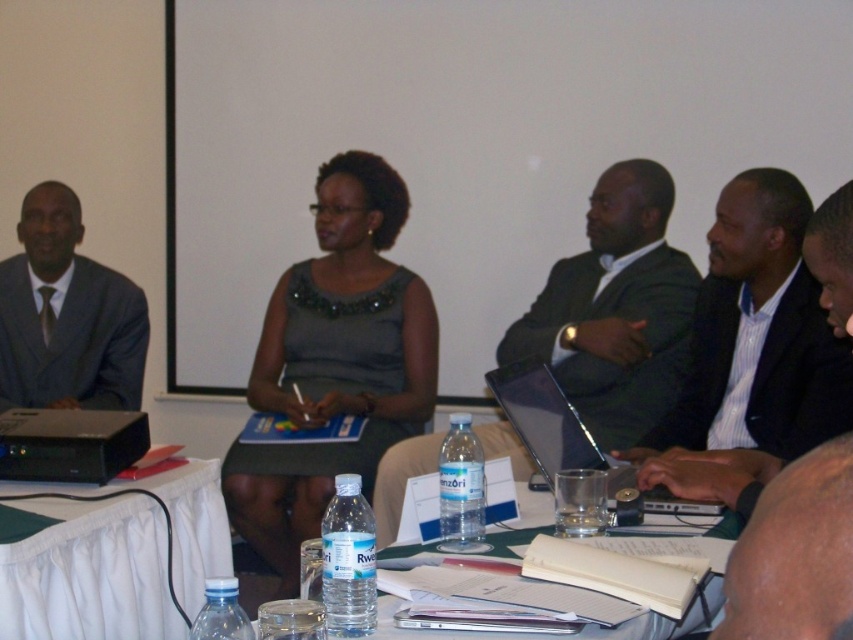
Which is below, gray matte dress at center or silver metallic laptop at center?

silver metallic laptop at center is below.

Is the position of gray matte dress at center more distant than that of silver metallic laptop at center?

Yes, it is.

Locate an element on the screen. This screenshot has width=853, height=640. gray matte dress at center is located at coordinates (334, 364).

Which is more to the right, gray matte dress at center or smooth black laptop at center?

From the viewer's perspective, smooth black laptop at center appears more on the right side.

The height and width of the screenshot is (640, 853). What do you see at coordinates (334, 364) in the screenshot?
I see `gray matte dress at center` at bounding box center [334, 364].

Who is more distant from viewer, (397, 323) or (821, 531)?

Point (397, 323)

Locate an element on the screen. The height and width of the screenshot is (640, 853). gray matte dress at center is located at coordinates (334, 364).

Which is in front, point (88, 307) or point (798, 600)?

Point (798, 600)

Is matte black suit at left taller than smooth black laptop at center?

Yes.

What do you see at coordinates (67, 316) in the screenshot?
I see `matte black suit at left` at bounding box center [67, 316].

Find the location of a particular element. This screenshot has width=853, height=640. matte black suit at left is located at coordinates (67, 316).